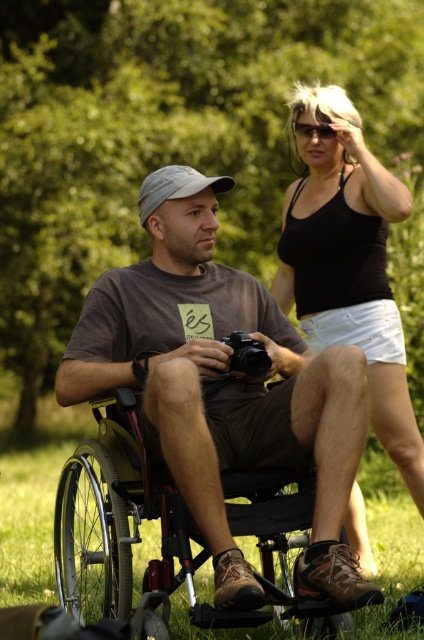
Question: Which of the following is the farthest from the observer?

Choices:
 (A) (323, 138)
 (B) (122, 604)
 (C) (262, 332)
 (D) (253, 369)

Answer: (A)

Question: Is black tank top at upper right wider than metallic silver wheelchair at lower left?

Choices:
 (A) yes
 (B) no

Answer: (B)

Question: Which is nearer to the metallic silver wheelchair at lower left?

Choices:
 (A) matte brown wheelchair at center
 (B) black tank top at upper right

Answer: (A)

Question: Is matte brown wheelchair at center thinner than matte gray baseball cap at center?

Choices:
 (A) yes
 (B) no

Answer: (B)

Question: Among these objects, which one is nearest to the camera?

Choices:
 (A) matte brown wheelchair at center
 (B) black plastic sunglasses at upper center
 (C) metallic silver wheelchair at lower left
 (D) black tank top at upper right

Answer: (A)

Question: Does black plastic camera at center lie behind black plastic sunglasses at upper center?

Choices:
 (A) no
 (B) yes

Answer: (A)